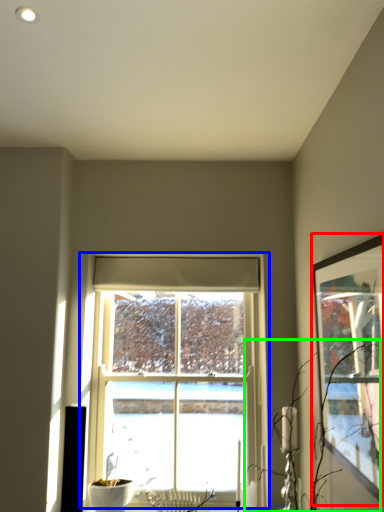
Question: Based on their relative distances, which object is farther from picture frame (highlighted by a red box)? Choose from window (highlighted by a blue box) and branch (highlighted by a green box).

Choices:
 (A) window
 (B) branch

Answer: (A)